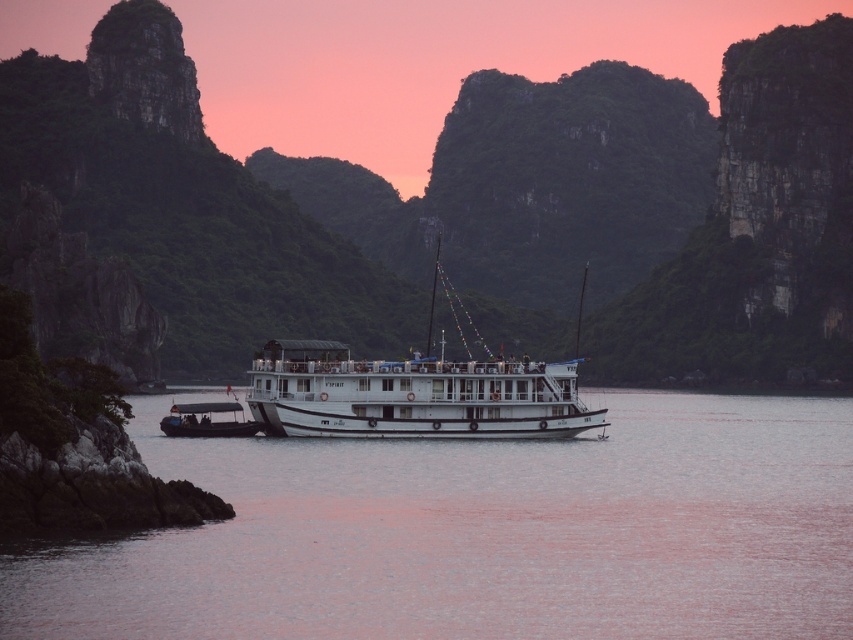
Is clear water at center taller than black rubber dinghy at lower left?

Indeed, clear water at center has a greater height compared to black rubber dinghy at lower left.

Locate an element on the screen. Image resolution: width=853 pixels, height=640 pixels. clear water at center is located at coordinates (480, 532).

Image resolution: width=853 pixels, height=640 pixels. Identify the location of clear water at center. (480, 532).

Can you confirm if white matte cruise ship at center is bigger than black rubber dinghy at lower left?

Yes, white matte cruise ship at center is bigger than black rubber dinghy at lower left.

Where is `white matte cruise ship at center`? This screenshot has width=853, height=640. white matte cruise ship at center is located at coordinates (410, 396).

Measure the distance between white matte cruise ship at center and camera.

The distance of white matte cruise ship at center from camera is 84.49 meters.

You are a GUI agent. You are given a task and a screenshot of the screen. Output one action in this format:
    pyautogui.click(x=<x>, y=<y>)
    Task: Click on the white matte cruise ship at center
    Image resolution: width=853 pixels, height=640 pixels.
    Given the screenshot: What is the action you would take?
    click(x=410, y=396)

Between clear water at center and white matte cruise ship at center, which one appears on the right side from the viewer's perspective?

From the viewer's perspective, white matte cruise ship at center appears more on the right side.

Measure the distance from clear water at center to white matte cruise ship at center.

clear water at center and white matte cruise ship at center are 62.27 feet apart from each other.

Describe the element at coordinates (480, 532) in the screenshot. The height and width of the screenshot is (640, 853). I see `clear water at center` at that location.

At what (x,y) coordinates should I click in order to perform the action: click on clear water at center. Please return your answer as a coordinate pair (x, y). The image size is (853, 640). Looking at the image, I should click on (480, 532).